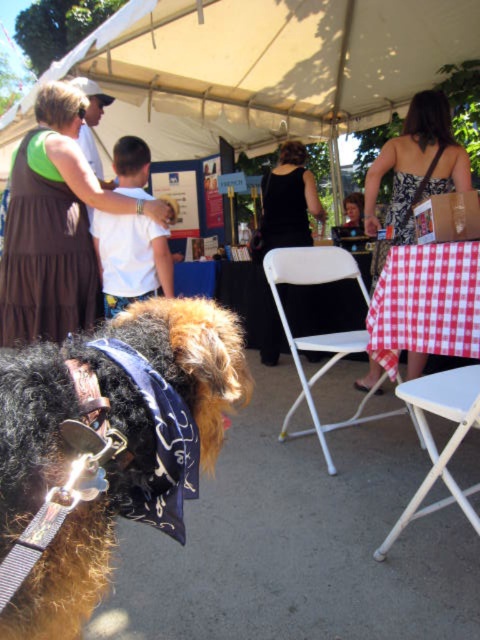
Can you confirm if blue satin neckband at lower left is smaller than smooth brown hair at center?

Yes.

Is blue satin neckband at lower left bigger than smooth brown hair at center?

No.

Who is more distant from viewer, (154,502) or (361,205)?

The point (361,205) is more distant.

You are a GUI agent. You are given a task and a screenshot of the screen. Output one action in this format:
    pyautogui.click(x=<x>, y=<y>)
    Task: Click on the blue satin neckband at lower left
    The image size is (480, 640).
    Given the screenshot: What is the action you would take?
    pyautogui.click(x=158, y=445)

Who is shorter, white cotton shirt at center or smooth brown hair at center?

smooth brown hair at center

Between white cotton shirt at center and smooth brown hair at center, which one appears on the left side from the viewer's perspective?

From the viewer's perspective, white cotton shirt at center appears more on the left side.

Who is more forward, (99,248) or (361,211)?

Point (99,248) is in front.

The height and width of the screenshot is (640, 480). What are the coordinates of `white cotton shirt at center` in the screenshot? It's located at (131, 259).

Does white plastic chair at lower right have a lesser height compared to white cotton shirt at center?

Incorrect, white plastic chair at lower right's height does not fall short of white cotton shirt at center's.

Does white plastic chair at lower right have a lesser width compared to white cotton shirt at center?

No.

Who is more forward, (376, 317) or (164, 291)?

Positioned in front is point (376, 317).

Identify the location of white plastic chair at lower right. Image resolution: width=480 pixels, height=640 pixels. (427, 301).